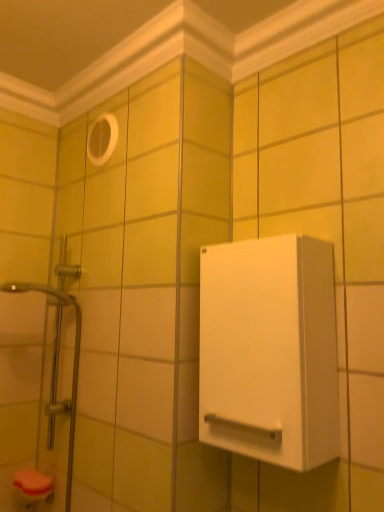
This screenshot has height=512, width=384. I want to click on white matte cabinet at right, so click(x=269, y=350).

Image resolution: width=384 pixels, height=512 pixels. I want to click on white matte cabinet at right, so click(x=269, y=350).

From the image's perspective, between white plastic hole at upper center and white matte cabinet at right, who is located below?

white matte cabinet at right.

Based on the photo, is white plastic hole at upper center oriented away from white matte cabinet at right?

No, white plastic hole at upper center's orientation is not away from white matte cabinet at right.

Is white plastic hole at upper center to the right of white matte cabinet at right from the viewer's perspective?

No.

Where is `medicine cabinet lying in front of the white plastic hole at upper center`? The height and width of the screenshot is (512, 384). medicine cabinet lying in front of the white plastic hole at upper center is located at coordinates (269, 350).

Is white matte cabinet at right oriented away from translucent glass shower door at left?

No, white matte cabinet at right's orientation is not away from translucent glass shower door at left.

From a real-world perspective, between white matte cabinet at right and translucent glass shower door at left, who is vertically higher?

From a 3D spatial view, white matte cabinet at right is above.

Can you tell me how much white matte cabinet at right and translucent glass shower door at left differ in facing direction?

There is a 0.411-degree angle between the facing directions of white matte cabinet at right and translucent glass shower door at left.

Is the position of translucent glass shower door at left less distant than that of white plastic hole at upper center?

Yes, translucent glass shower door at left is closer to the viewer.

Which object is positioned more to the left, translucent glass shower door at left or white plastic hole at upper center?

From the viewer's perspective, translucent glass shower door at left appears more on the left side.

From the picture: Is white plastic hole at upper center located within translucent glass shower door at left?

No, translucent glass shower door at left does not contain white plastic hole at upper center.

Is white matte cabinet at right placed right next to white plastic hole at upper center?

No, white matte cabinet at right is not in contact with white plastic hole at upper center.

From a real-world perspective, is white matte cabinet at right over white plastic hole at upper center?

Actually, white matte cabinet at right is physically below white plastic hole at upper center in the real world.

Do you think white matte cabinet at right is within white plastic hole at upper center, or outside of it?

white matte cabinet at right exists outside the volume of white plastic hole at upper center.

From the image's perspective, which one is positioned higher, white matte cabinet at right or white plastic hole at upper center?

white plastic hole at upper center is shown above in the image.

Does translucent glass shower door at left turn towards white matte cabinet at right?

No, translucent glass shower door at left is not oriented towards white matte cabinet at right.

Is white matte cabinet at right inside translucent glass shower door at left?

That's incorrect, white matte cabinet at right is not inside translucent glass shower door at left.

Can you confirm if translucent glass shower door at left is wider than white matte cabinet at right?

Yes, translucent glass shower door at left is wider than white matte cabinet at right.

Is point (71, 436) in front of point (298, 460)?

No, (71, 436) is further to viewer.

Between white plastic hole at upper center and translucent glass shower door at left, which one has larger width?

translucent glass shower door at left is wider.

From the picture: Is white plastic hole at upper center to the left or to the right of translucent glass shower door at left in the image?

Based on their positions, white plastic hole at upper center is located to the right of translucent glass shower door at left.

Image resolution: width=384 pixels, height=512 pixels. Identify the location of shower door in front of the white plastic hole at upper center. (74, 359).

Who is smaller, white plastic hole at upper center or translucent glass shower door at left?

white plastic hole at upper center.

At what (x,y) coordinates should I click in order to perform the action: click on hole that appears above the white matte cabinet at right (from a real-world perspective). Please return your answer as a coordinate pair (x, y). This screenshot has height=512, width=384. Looking at the image, I should click on (102, 139).

The width and height of the screenshot is (384, 512). In order to click on medicine cabinet above the translucent glass shower door at left (from the image's perspective) in this screenshot , I will do `click(269, 350)`.

Looking at the image, which one is located closer to translucent glass shower door at left, white plastic hole at upper center or white matte cabinet at right?

white plastic hole at upper center.

From the image, which object appears to be farther from white matte cabinet at right, white plastic hole at upper center or translucent glass shower door at left?

Based on the image, white plastic hole at upper center appears to be further to white matte cabinet at right.

Looking at the image, which one is located closer to translucent glass shower door at left, white matte cabinet at right or white plastic hole at upper center?

white plastic hole at upper center is closer to translucent glass shower door at left.

When comparing their distances from white plastic hole at upper center, does white matte cabinet at right or translucent glass shower door at left seem closer?

translucent glass shower door at left lies closer to white plastic hole at upper center than the other object.

Which object lies nearer to the anchor point white matte cabinet at right, translucent glass shower door at left or white plastic hole at upper center?

translucent glass shower door at left is closer to white matte cabinet at right.

Considering their positions, is translucent glass shower door at left positioned closer to white plastic hole at upper center than white matte cabinet at right?

translucent glass shower door at left.

This screenshot has height=512, width=384. Find the location of `medicine cabinet between white plastic hole at upper center and translucent glass shower door at left vertically`. medicine cabinet between white plastic hole at upper center and translucent glass shower door at left vertically is located at coordinates (269, 350).